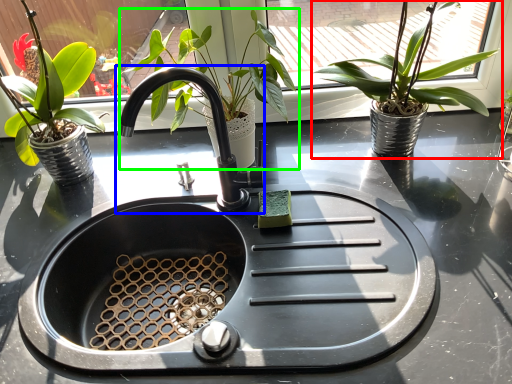
Question: Which object is positioned farthest from houseplant (highlighted by a red box)? Select from tap (highlighted by a blue box) and houseplant (highlighted by a green box).

Choices:
 (A) tap
 (B) houseplant

Answer: (A)